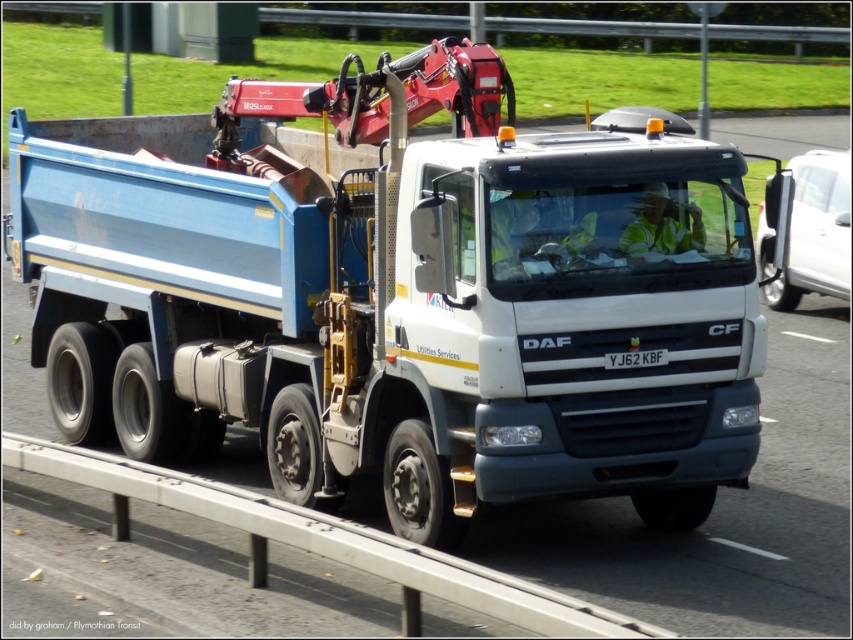
You are a traffic controller monitoring a highway. You notice a matte blue truck at center on the road. Based on its position coordinates, can you determine if it is driving in the correct lane for this road?

The matte blue truck at center is positioned at coordinates point (399, 305), which is within the correct lane for the road as per standard highway lane positioning.

You are a traffic officer observing a truck on the highway. You notice the matte blue truck at center and the black plastic license plate at center. Which object is positioned more to the right?

The black plastic license plate at center is positioned more to the right than the matte blue truck at center.

You are a traffic officer observing a truck on the highway. You notice the matte blue truck at center and the black plastic license plate at center. Which object is positioned higher from the ground?

The matte blue truck at center is above the black plastic license plate at center, so the matte blue truck at center is higher from the ground.